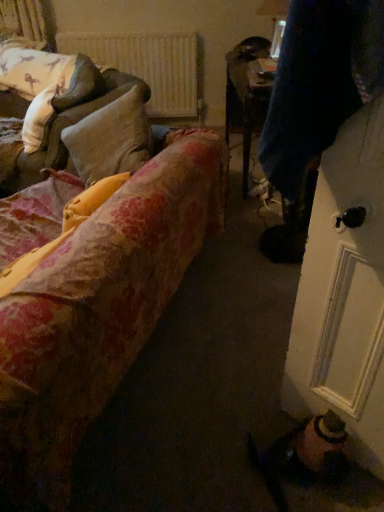
Locate an element on the screen. Image resolution: width=384 pixels, height=512 pixels. floral fabric couch at left, positioned as the 1th studio couch in front-to-back order is located at coordinates (99, 310).

I want to click on white textured radiator at upper center, so click(x=147, y=65).

Are white soft pillow at upper left and white textured radiator at upper center located far from each other?

That's right, there is a large distance between white soft pillow at upper left and white textured radiator at upper center.

How many degrees apart are the facing directions of white soft pillow at upper left and white textured radiator at upper center?

white soft pillow at upper left and white textured radiator at upper center are facing 120 degrees away from each other.

Is white soft pillow at upper left taller or shorter than white textured radiator at upper center?

In the image, white soft pillow at upper left appears to be shorter than white textured radiator at upper center.

Which object is wider, white soft pillow at upper left or white textured radiator at upper center?

With larger width is white soft pillow at upper left.

Is white textured radiator at upper center located outside floral fabric couch at left, the first studio couch positioned from the back?

white textured radiator at upper center lies outside floral fabric couch at left, the first studio couch positioned from the back,'s area.

From a real-world perspective, which is physically above, white textured radiator at upper center or floral fabric couch at left, the 2th studio couch viewed from the front?

floral fabric couch at left, the 2th studio couch viewed from the front, from a real-world perspective.

Is white textured radiator at upper center wider than floral fabric couch at left, the first studio couch positioned from the back?

Incorrect, the width of white textured radiator at upper center does not surpass that of floral fabric couch at left, the first studio couch positioned from the back.

Is white textured radiator at upper center turned away from floral fabric couch at left, the 2th studio couch viewed from the front?

No, white textured radiator at upper center's orientation is not away from floral fabric couch at left, the 2th studio couch viewed from the front.

What's the angular difference between white textured radiator at upper center and velvet dark blue coat at right's facing directions?

There is a 90-degree angle between the facing directions of white textured radiator at upper center and velvet dark blue coat at right.

From the image's perspective, who appears lower, white textured radiator at upper center or velvet dark blue coat at right?

velvet dark blue coat at right.

Considering the positions of point (147, 63) and point (300, 153), is point (147, 63) closer or farther from the camera than point (300, 153)?

Point (147, 63).

Could you tell me if white textured radiator at upper center is turned towards velvet dark blue coat at right?

Yes, white textured radiator at upper center is turned towards velvet dark blue coat at right.

How different are the orientations of floral fabric couch at left, the first studio couch positioned from the back, and white textured radiator at upper center in degrees?

122 degrees.

Which of these two, floral fabric couch at left, the first studio couch positioned from the back, or white textured radiator at upper center, stands taller?

With more height is white textured radiator at upper center.

Is floral fabric couch at left, the first studio couch positioned from the back, bigger than white textured radiator at upper center?

Yes, floral fabric couch at left, the first studio couch positioned from the back, is bigger than white textured radiator at upper center.

From the image's perspective, is floral fabric couch at left, the first studio couch positioned from the back, below white textured radiator at upper center?

Correct, floral fabric couch at left, the first studio couch positioned from the back, appears lower than white textured radiator at upper center in the image.

What are the coordinates of `radiator above the floral fabric couch at left, positioned as the 1th studio couch in front-to-back order (from a real-world perspective)` in the screenshot? It's located at (147, 65).

From a real-world perspective, is floral fabric couch at left, acting as the second studio couch starting from the back, located higher than white textured radiator at upper center?

No, from a real-world perspective, floral fabric couch at left, acting as the second studio couch starting from the back, is not above white textured radiator at upper center.

Who is taller, floral fabric couch at left, positioned as the 1th studio couch in front-to-back order, or white textured radiator at upper center?

floral fabric couch at left, positioned as the 1th studio couch in front-to-back order.

In terms of width, does floral fabric couch at left, acting as the second studio couch starting from the back, look wider or thinner when compared to white textured radiator at upper center?

Clearly, floral fabric couch at left, acting as the second studio couch starting from the back, has more width compared to white textured radiator at upper center.

Can you confirm if floral fabric couch at left, positioned as the 1th studio couch in front-to-back order, is taller than floral fabric couch at left, the first studio couch positioned from the back?

Yes.

Is floral fabric couch at left, acting as the second studio couch starting from the back, positioned before floral fabric couch at left, the 2th studio couch viewed from the front?

Yes, floral fabric couch at left, acting as the second studio couch starting from the back, is closer to the viewer.

Is floral fabric couch at left, acting as the second studio couch starting from the back, thinner than floral fabric couch at left, the 2th studio couch viewed from the front?

Incorrect, the width of floral fabric couch at left, acting as the second studio couch starting from the back, is not less than that of floral fabric couch at left, the 2th studio couch viewed from the front.

From the picture: Is floral fabric couch at left, the first studio couch positioned from the back, inside floral fabric couch at left, positioned as the 1th studio couch in front-to-back order?

That's correct, floral fabric couch at left, the first studio couch positioned from the back, is inside floral fabric couch at left, positioned as the 1th studio couch in front-to-back order.

In the scene shown: Is floral fabric couch at left, the first studio couch positioned from the back, inside or outside of floral fabric couch at left, acting as the second studio couch starting from the back?

floral fabric couch at left, the first studio couch positioned from the back, is located inside floral fabric couch at left, acting as the second studio couch starting from the back.

Find the location of a particular element. The image size is (384, 512). studio couch that is below the floral fabric couch at left, the first studio couch positioned from the back (from the image's perspective) is located at coordinates (99, 310).

From a real-world perspective, is floral fabric couch at left, the 2th studio couch viewed from the front, below floral fabric couch at left, positioned as the 1th studio couch in front-to-back order?

No, from a real-world perspective, floral fabric couch at left, the 2th studio couch viewed from the front, is not under floral fabric couch at left, positioned as the 1th studio couch in front-to-back order.

Which is in front, floral fabric couch at left, the first studio couch positioned from the back, or floral fabric couch at left, acting as the second studio couch starting from the back?

Positioned in front is floral fabric couch at left, acting as the second studio couch starting from the back.

You are a GUI agent. You are given a task and a screenshot of the screen. Output one action in this format:
    pyautogui.click(x=<x>, y=<y>)
    Task: Click on the radiator on the right of white soft pillow at upper left
    The image size is (384, 512).
    Given the screenshot: What is the action you would take?
    pyautogui.click(x=147, y=65)

Where is `radiator that appears below the floral fabric couch at left, the 2th studio couch viewed from the front (from a real-world perspective)`? The height and width of the screenshot is (512, 384). radiator that appears below the floral fabric couch at left, the 2th studio couch viewed from the front (from a real-world perspective) is located at coordinates (147, 65).

When comparing their distances from floral fabric couch at left, the 2th studio couch viewed from the front, does white soft pillow at upper left or white textured radiator at upper center seem further?

white textured radiator at upper center is positioned further to the anchor floral fabric couch at left, the 2th studio couch viewed from the front.

From the image, which object appears to be nearer to velvet dark blue coat at right, white textured radiator at upper center or white soft pillow at upper left?

Among the two, white soft pillow at upper left is located nearer to velvet dark blue coat at right.

Looking at the image, which one is located further to velvet dark blue coat at right, floral fabric couch at left, positioned as the 1th studio couch in front-to-back order, or white soft pillow at upper left?

white soft pillow at upper left.

Based on their spatial positions, is floral fabric couch at left, positioned as the 1th studio couch in front-to-back order, or velvet dark blue coat at right further from white soft pillow at upper left?

Among the two, velvet dark blue coat at right is located further to white soft pillow at upper left.

Looking at the image, which one is located further to white soft pillow at upper left, velvet dark blue coat at right or floral fabric couch at left, positioned as the 1th studio couch in front-to-back order?

Among the two, velvet dark blue coat at right is located further to white soft pillow at upper left.

Which object lies nearer to the anchor point floral fabric couch at left, acting as the second studio couch starting from the back, floral fabric couch at left, the 2th studio couch viewed from the front, or white soft pillow at upper left?

floral fabric couch at left, the 2th studio couch viewed from the front, lies closer to floral fabric couch at left, acting as the second studio couch starting from the back, than the other object.

Which object lies further to the anchor point white textured radiator at upper center, floral fabric couch at left, the first studio couch positioned from the back, or velvet dark blue coat at right?

Based on the image, velvet dark blue coat at right appears to be further to white textured radiator at upper center.

Which object lies nearer to the anchor point floral fabric couch at left, the 2th studio couch viewed from the front, white textured radiator at upper center or white soft pillow at upper left?

Among the two, white soft pillow at upper left is located nearer to floral fabric couch at left, the 2th studio couch viewed from the front.

Locate an element on the screen. couple between floral fabric couch at left, positioned as the 1th studio couch in front-to-back order, and white textured radiator at upper center, along the z-axis is located at coordinates (316, 98).

Locate an element on the screen. The height and width of the screenshot is (512, 384). pillow located between floral fabric couch at left, the first studio couch positioned from the back, and white textured radiator at upper center in the depth direction is located at coordinates (60, 102).

Where is `couple between floral fabric couch at left, positioned as the 1th studio couch in front-to-back order, and white soft pillow at upper left, along the z-axis`? The image size is (384, 512). couple between floral fabric couch at left, positioned as the 1th studio couch in front-to-back order, and white soft pillow at upper left, along the z-axis is located at coordinates (316, 98).

At what (x,y) coordinates should I click in order to perform the action: click on studio couch located between velvet dark blue coat at right and white textured radiator at upper center in the depth direction. Please return your answer as a coordinate pair (x, y). This screenshot has height=512, width=384. Looking at the image, I should click on (72, 117).